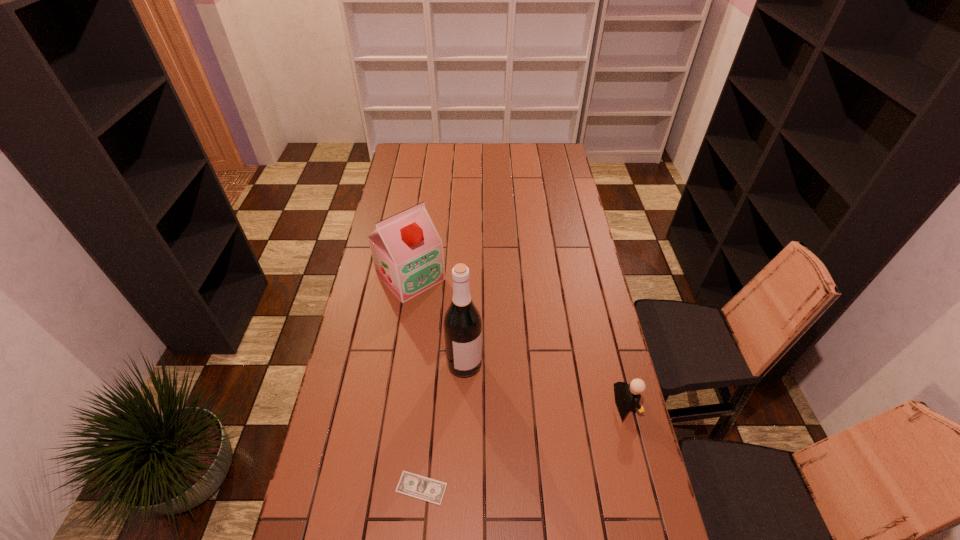
This screenshot has width=960, height=540. Find the location of `vacant space located on the label of the tallest object`. vacant space located on the label of the tallest object is located at coordinates pos(479,396).

Image resolution: width=960 pixels, height=540 pixels. In order to click on vacant space situated on the label of the tallest object in this screenshot , I will do `click(477, 390)`.

Where is `vacant space located 0.270m with the cap open on the farthest object`? vacant space located 0.270m with the cap open on the farthest object is located at coordinates click(x=475, y=343).

Locate an element on the screen. free space located 0.180m with the cap open on the farthest object is located at coordinates (459, 327).

This screenshot has width=960, height=540. Find the location of `free location located with the cap open on the farthest object`. free location located with the cap open on the farthest object is located at coordinates (483, 351).

What are the coordinates of `object located in the near edge section of the desktop` in the screenshot? It's located at (410, 484).

Locate an element on the screen. object positioned at the left edge is located at coordinates (407, 251).

This screenshot has width=960, height=540. Find the location of `object at the right edge`. object at the right edge is located at coordinates (627, 396).

This screenshot has width=960, height=540. Find the location of `free space at the far edge of the desktop`. free space at the far edge of the desktop is located at coordinates (507, 163).

Find the location of a particular element. blank space at the left edge is located at coordinates (331, 442).